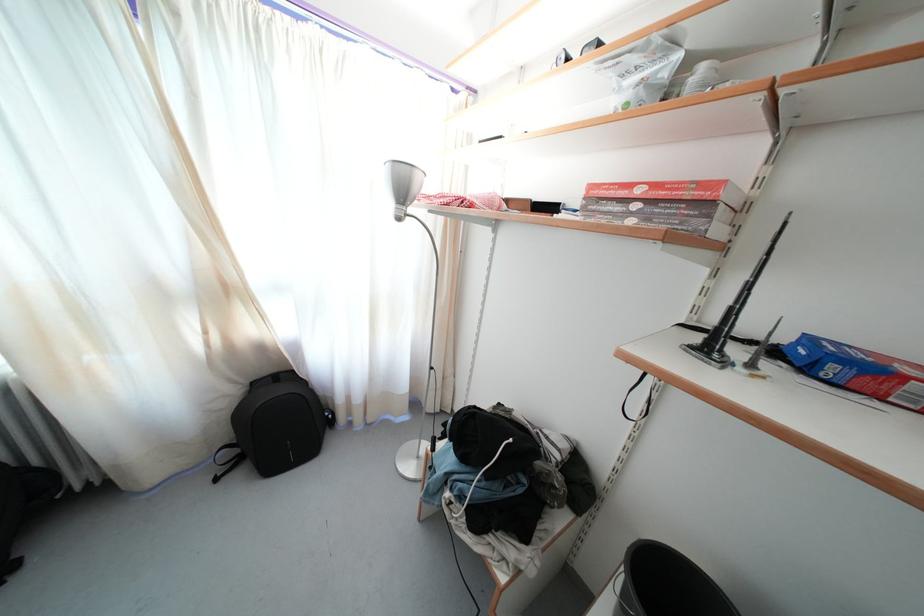
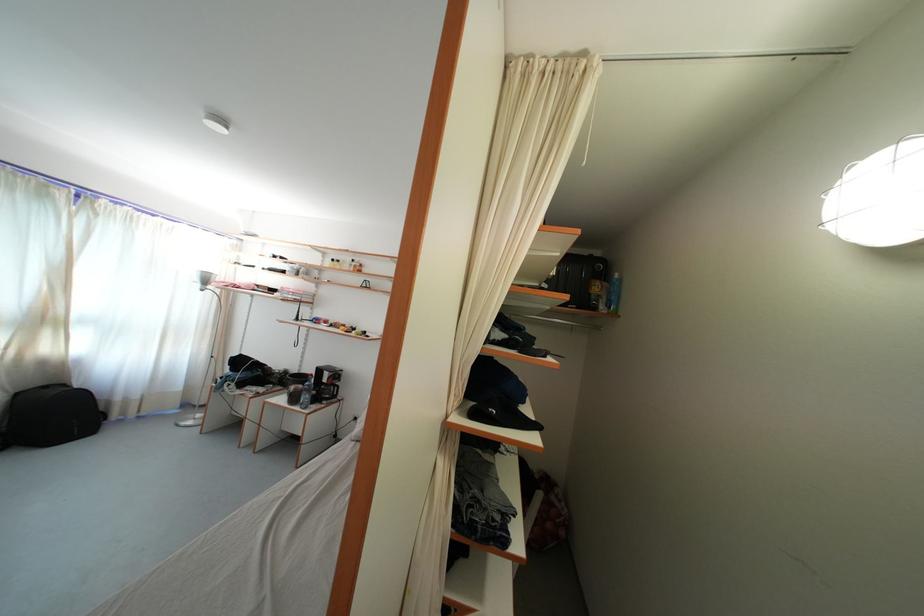
Find the pixel in the second image that matches the point at 229,297 in the first image.

(52, 326)